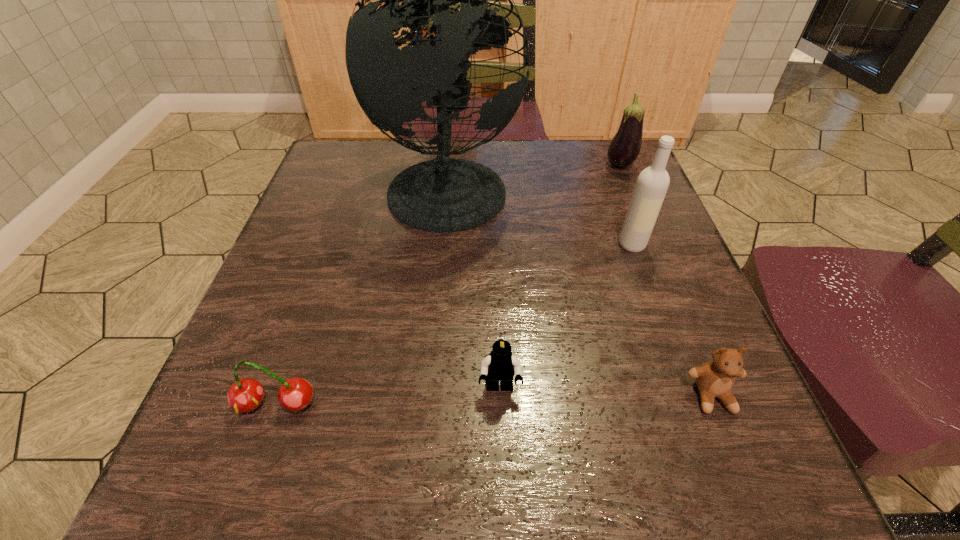
Find the location of a particular element. This screenshot has height=540, width=960. globe is located at coordinates (444, 195).

Image resolution: width=960 pixels, height=540 pixels. I want to click on vodka, so click(652, 184).

You are a GUI agent. You are given a task and a screenshot of the screen. Output one action in this format:
    pyautogui.click(x=<x>, y=<y>)
    Task: Click on the fourth shortest object
    The width and height of the screenshot is (960, 540).
    Given the screenshot: What is the action you would take?
    pyautogui.click(x=625, y=146)

Locate an element on the screen. Image resolution: width=960 pixels, height=540 pixels. cherry is located at coordinates (295, 394).

Locate an element on the screen. This screenshot has height=540, width=960. Lego is located at coordinates (500, 365).

Where is `teddy bear`? teddy bear is located at coordinates (715, 378).

Identify the location of vacant space located 0.050m on the front-facing side of the tallest object. (541, 186).

The width and height of the screenshot is (960, 540). I want to click on vacant space located 0.280m on the left of the vodka, so click(478, 245).

I want to click on vacant area located 0.240m on the front of the fourth shortest object, so click(x=650, y=241).

Where is `free spot located 0.050m with stems pointing upwards on the cherry`? The width and height of the screenshot is (960, 540). free spot located 0.050m with stems pointing upwards on the cherry is located at coordinates (257, 456).